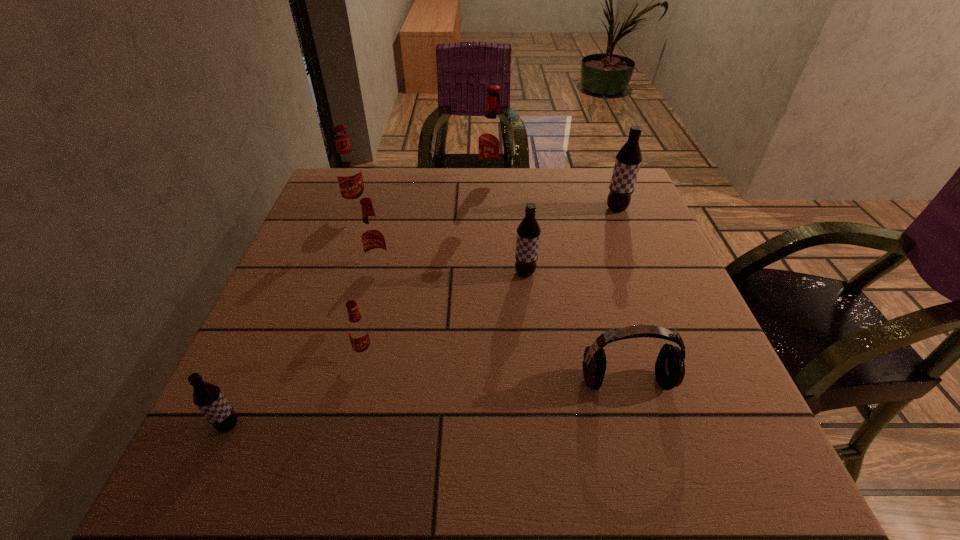
The image size is (960, 540). What are the coordinates of `free point between the leftmost root beer and the second nearest red root beer` in the screenshot? It's located at (304, 346).

The height and width of the screenshot is (540, 960). I want to click on free space between the leftmost object and the second nearest root beer, so click(x=297, y=389).

Locate an element on the screen. free space between the leftmost object and the third farthest red root beer is located at coordinates (304, 346).

This screenshot has height=540, width=960. In order to click on object that can be found as the second closest to the second nearest red root beer in this screenshot , I will do `click(359, 334)`.

Where is `object that is the second closest to the second nearest object`? This screenshot has width=960, height=540. object that is the second closest to the second nearest object is located at coordinates tap(359, 334).

At what (x,y) coordinates should I click in order to perform the action: click on root beer that is the sixth closest to the second nearest red root beer. Please return your answer as a coordinate pair (x, y). This screenshot has height=540, width=960. Looking at the image, I should click on (628, 159).

Point out which root beer is positioned as the nearest to the seventh farthest object. Please provide its 2D coordinates. Your answer should be formatted as a tuple, i.e. [(x, y)], where the tuple contains the x and y coordinates of a point satisfying the conditions above.

[(528, 232)]

In order to click on red root beer that is the third closest to the second brown root beer from left to right in this screenshot , I will do `click(492, 139)`.

Identify the location of red root beer that is the third closest to the nearest root beer. (348, 170).

Find the location of a particular element. brown root beer that is the nearest to the leftmost object is located at coordinates (528, 232).